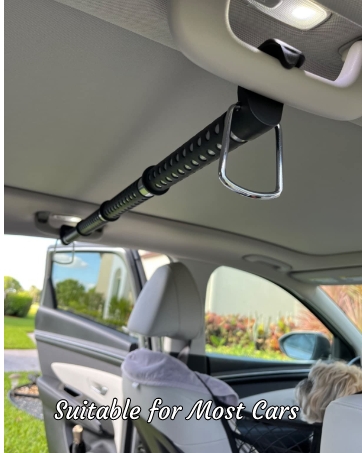
This screenshot has height=453, width=362. I want to click on bar, so click(x=178, y=164).